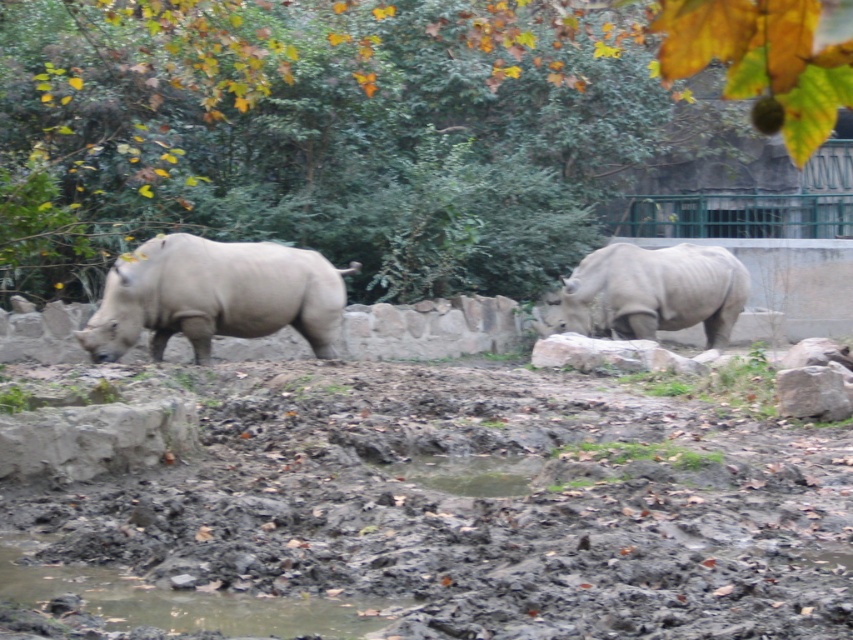
Question: Does damp mud at lower center appear over shiny mud puddle at center?

Choices:
 (A) no
 (B) yes

Answer: (A)

Question: Is green leafy tree at upper center positioned in front of damp mud at lower center?

Choices:
 (A) yes
 (B) no

Answer: (B)

Question: Which of the following is the farthest from the observer?

Choices:
 (A) (321, 244)
 (B) (459, 442)

Answer: (A)

Question: Estimate the real-world distances between objects in this image. Which object is farther from the matte gray rhinoceros at left?

Choices:
 (A) damp mud at lower center
 (B) gray rough rock at right

Answer: (A)

Question: Which object is the closest to the damp mud at lower center?

Choices:
 (A) matte gray rhinoceros at left
 (B) green leafy tree at upper center

Answer: (A)

Question: Is gray matte rhinoceros at center smaller than shiny mud puddle at center?

Choices:
 (A) no
 (B) yes

Answer: (A)